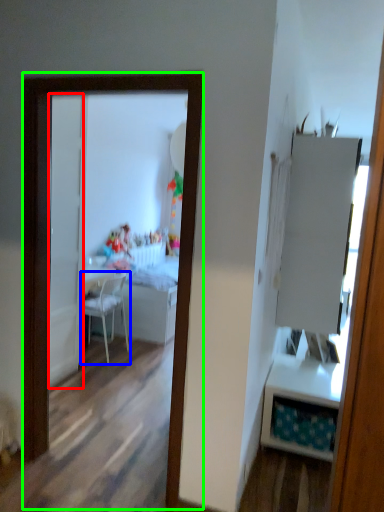
Question: Which object is positioned closest to door (highlighted by a red box)? Select from chair (highlighted by a blue box) and mirror (highlighted by a green box).

Choices:
 (A) chair
 (B) mirror

Answer: (A)